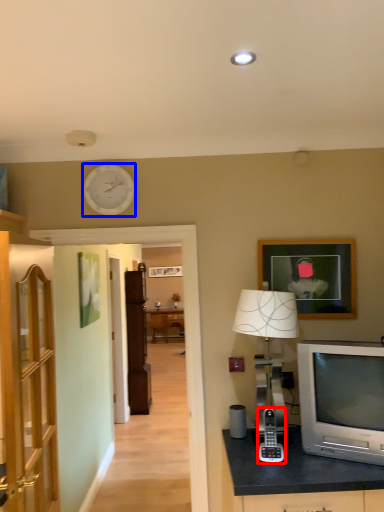
Question: Which of the following is the closest to the observer, gadget (highlighted by a red box) or clock (highlighted by a blue box)?

Choices:
 (A) gadget
 (B) clock

Answer: (A)